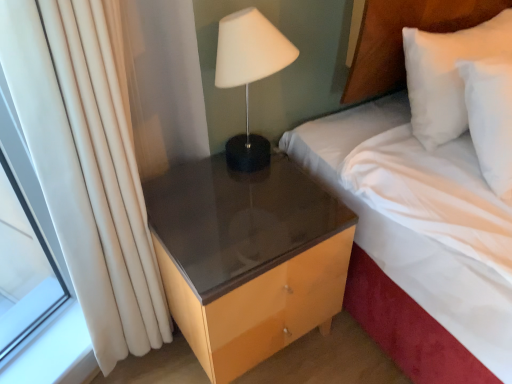
Question: Based on their positions, is white soft pillow at upper right located to the left or right of white fabric bed at upper right?

Choices:
 (A) right
 (B) left

Answer: (B)

Question: Considering the positions of white soft pillow at upper right and white fabric bed at upper right in the image, is white soft pillow at upper right wider or thinner than white fabric bed at upper right?

Choices:
 (A) thin
 (B) wide

Answer: (A)

Question: Which of these objects is positioned farthest from the glossy wood nightstand at lower right?

Choices:
 (A) white soft pillow at upper right
 (B) white matte lamp at upper right
 (C) white fabric bed at upper right

Answer: (A)

Question: Which is farther from the white fabric bed at upper right?

Choices:
 (A) glossy wood nightstand at lower right
 (B) white soft pillow at upper right
 (C) white matte lamp at upper right

Answer: (C)